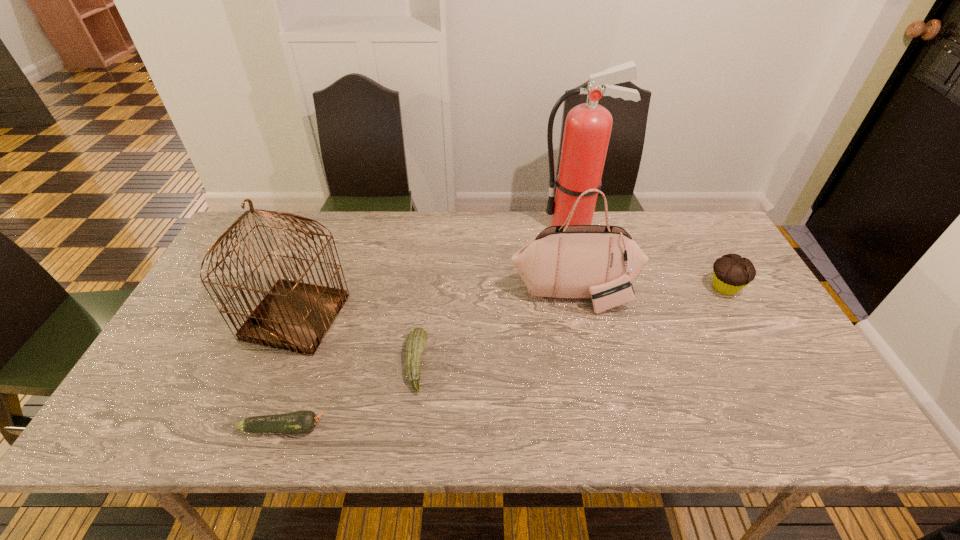
The image size is (960, 540). Find the location of `the farthest object`. the farthest object is located at coordinates (588, 126).

This screenshot has width=960, height=540. In order to click on fire extinguisher in this screenshot , I will do `click(588, 126)`.

Where is `birdcage`? Image resolution: width=960 pixels, height=540 pixels. birdcage is located at coordinates (293, 315).

Identify the location of handbag. (600, 262).

Find the location of a particular element. The height and width of the screenshot is (540, 960). the rightmost object is located at coordinates (731, 273).

The height and width of the screenshot is (540, 960). What are the coordinates of `the third shortest object` in the screenshot? It's located at (731, 273).

Where is `the right zucchini`? the right zucchini is located at coordinates (417, 338).

Find the location of a particular element. This screenshot has height=540, width=960. the third object from left to right is located at coordinates (417, 338).

You are a GUI agent. You are given a task and a screenshot of the screen. Output one action in this format:
    pyautogui.click(x=<x>, y=<y>)
    Task: Click on the nearest object
    
    Given the screenshot: What is the action you would take?
    pyautogui.click(x=299, y=422)

The height and width of the screenshot is (540, 960). In order to click on the left zucchini in this screenshot , I will do tap(299, 422).